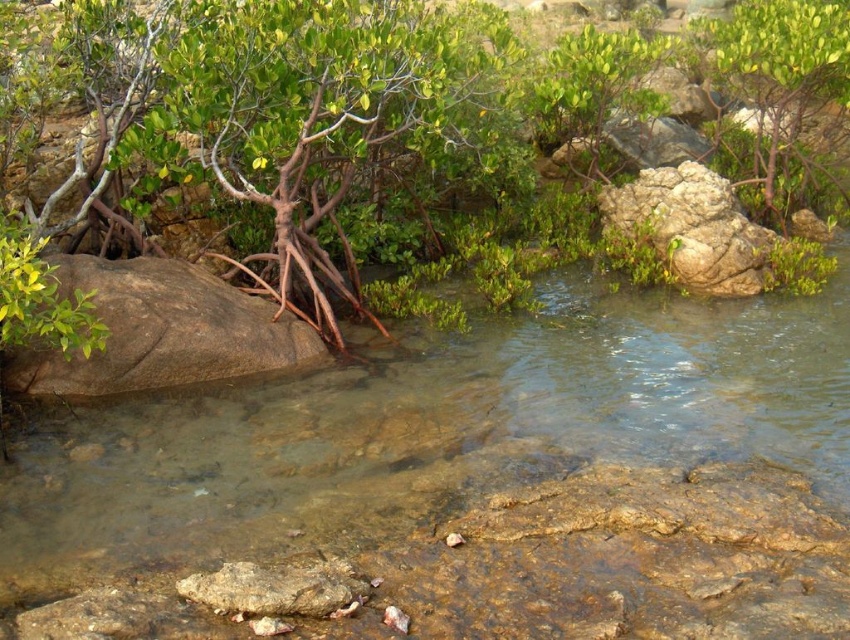
Which is behind, point (615, 348) or point (115, 337)?

The point (615, 348) is behind.

This screenshot has width=850, height=640. Describe the element at coordinates (472, 483) in the screenshot. I see `clear water at center` at that location.

The height and width of the screenshot is (640, 850). Identify the location of clear water at center. (472, 483).

Who is more forward, (89, 262) or (743, 92)?

Point (89, 262) is more forward.

Between brown rough boulder at lower left and green matte tree at upper right, which one is positioned higher?

green matte tree at upper right

Is point (21, 369) closer to viewer compared to point (763, 154)?

Yes.

The image size is (850, 640). I want to click on brown rough boulder at lower left, so click(x=162, y=330).

This screenshot has width=850, height=640. What are the coordinates of `clear water at center` in the screenshot? It's located at (472, 483).

Find the location of a particular element. clear water at center is located at coordinates (472, 483).